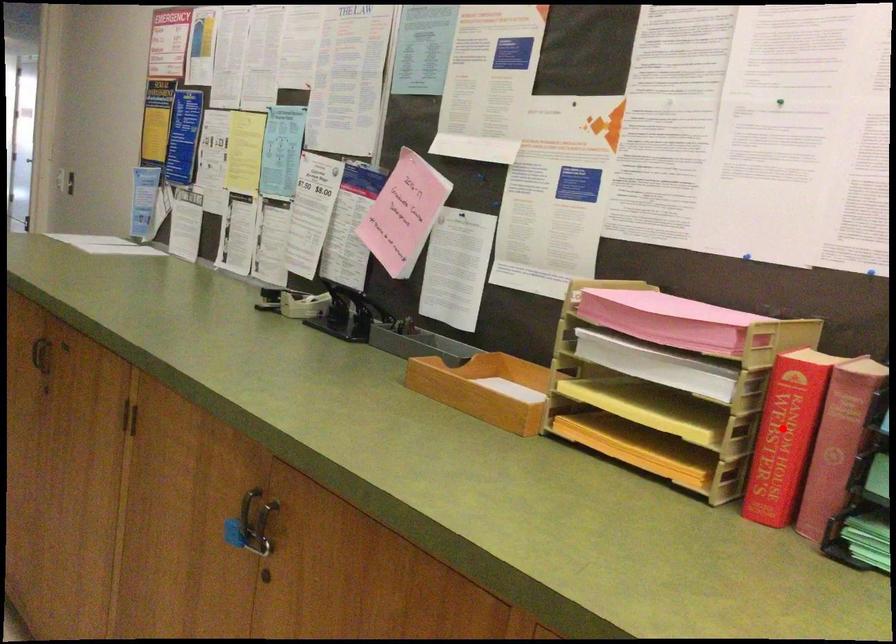
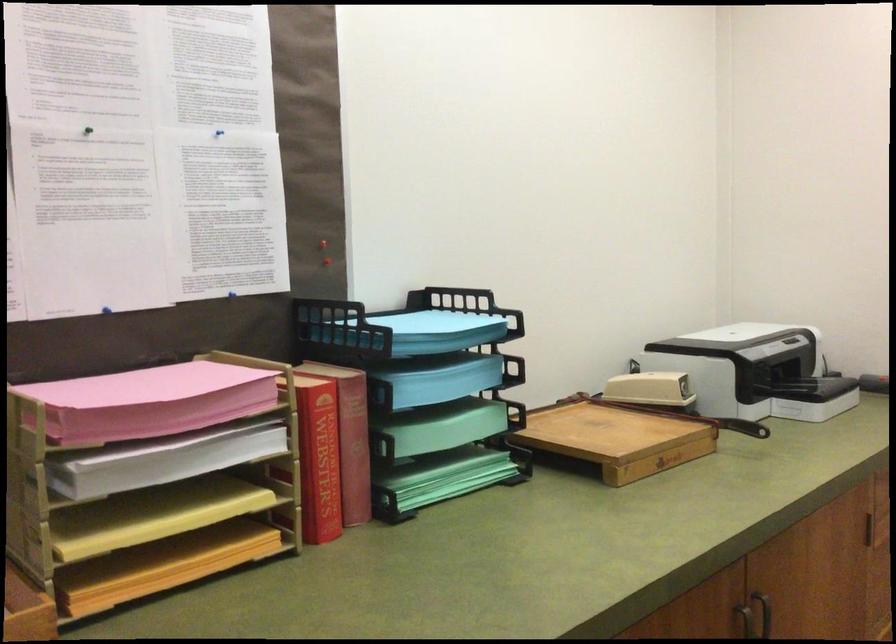
Where in the second image is the point corresponding to the highlighted location from the first image?

(319, 456)